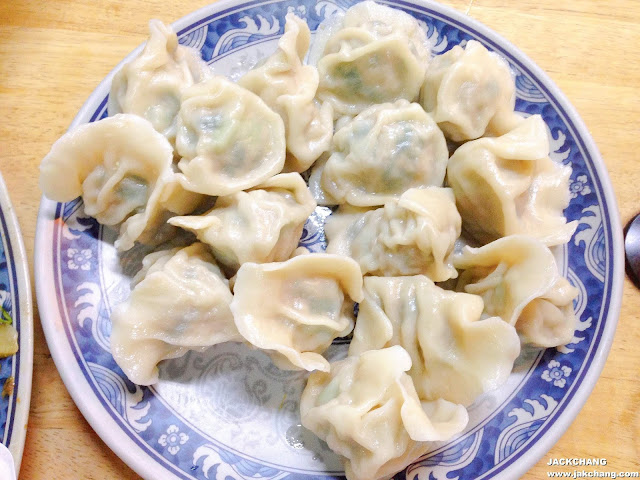
The image size is (640, 480). I want to click on blue and white plate, so click(x=554, y=398).